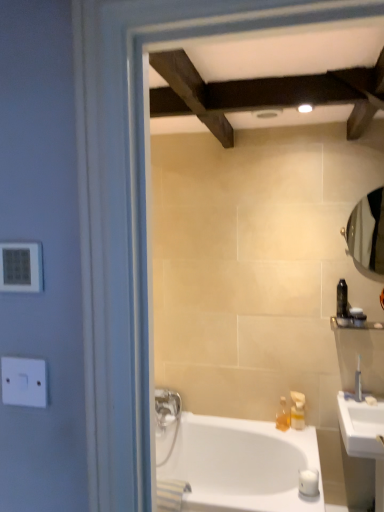
Locate an element on the screen. The image size is (384, 512). vacant region to the left of translucent plastic soap dispenser at right, which ranks as the 1th toiletry in left-to-right order is located at coordinates (273, 429).